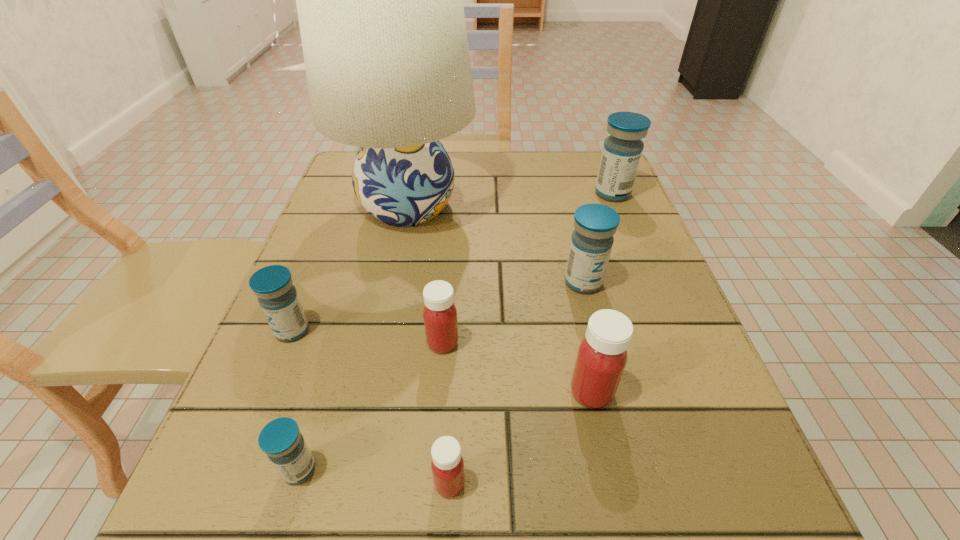
At what (x,y) coordinates should I click in order to perform the action: click on vacant space at the left edge of the desktop. Please return your answer as a coordinate pair (x, y). The width and height of the screenshot is (960, 540). Looking at the image, I should click on (250, 460).

At what (x,y) coordinates should I click in order to perform the action: click on vacant space at the right edge of the desktop. Please return your answer as a coordinate pair (x, y). Looking at the image, I should click on (638, 267).

Identify the location of free location at the far right corner of the desktop. The width and height of the screenshot is (960, 540). (570, 186).

Find the location of a particular element. The image size is (960, 540). vacant space at the near right corner of the desktop is located at coordinates (782, 523).

Where is `empty space between the smallest blue medicine and the biggest red medicine`? This screenshot has width=960, height=540. empty space between the smallest blue medicine and the biggest red medicine is located at coordinates (445, 430).

The height and width of the screenshot is (540, 960). Identify the location of free space between the tallest medicine and the leftmost medicine. (452, 262).

Locate an element on the screen. This screenshot has height=540, width=960. free space between the sixth nearest medicine and the nearest blue medicine is located at coordinates (442, 376).

The width and height of the screenshot is (960, 540). Identify the location of blank region between the farthest medicine and the nearest red medicine. pos(531,339).

Locate an element on the screen. Image resolution: width=960 pixels, height=540 pixels. empty space that is in between the lampshade and the leftmost medicine is located at coordinates (350, 268).

You are a GUI agent. You are given a task and a screenshot of the screen. Output one action in this format:
    pyautogui.click(x=<x>, y=<y>)
    Task: Click on the vacant region between the third nearest medicine and the tallest medicine
    The height and width of the screenshot is (540, 960).
    Given the screenshot: What is the action you would take?
    pyautogui.click(x=602, y=293)